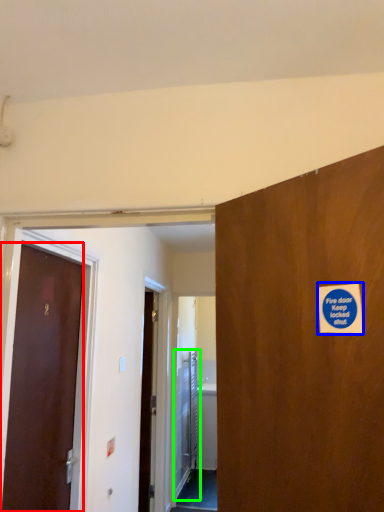
Question: Which object is the closest to the door (highlighted by a red box)? Choose among these: sticker (highlighted by a blue box) or elevator door (highlighted by a green box).

Choices:
 (A) sticker
 (B) elevator door

Answer: (A)